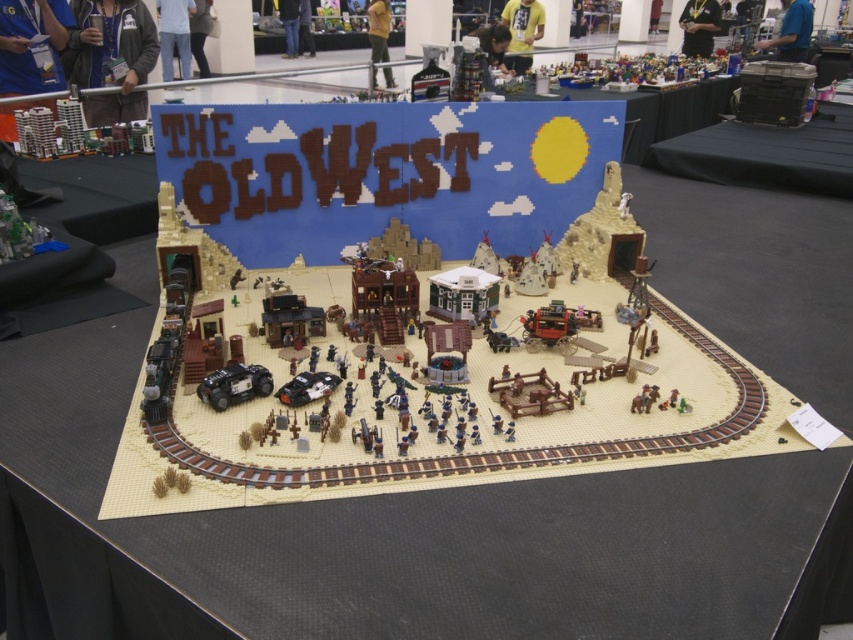
What are the coordinates of the matte plastic toy at upper center in the LEGO diorama?

The matte plastic toy at upper center is located at coordinates point [640,68].

In the scene shown: You are standing in front of the LEGO Old West diorama and want to place a new LEGO figure. You have two spots marked by coordinates to choose from. The first spot is at point [543,74] and the second is at point [248,397]. Which of these two points is closer to you?

Point [543,74] is closer to you because it is further to the viewer than point [248,397].